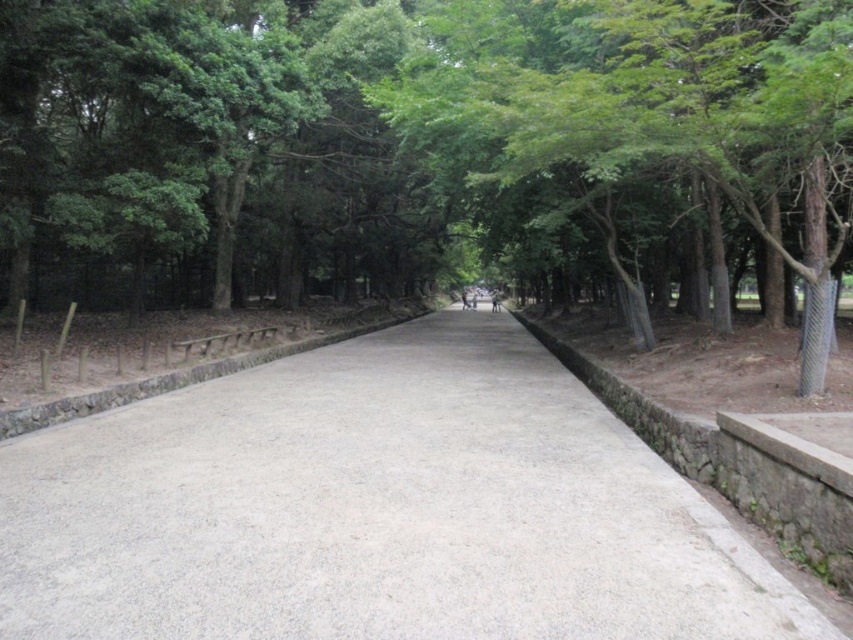
Which is in front, point (39, 19) or point (619, 440)?

Point (619, 440)

Does green leafy tree at center have a lesser width compared to gray concrete pavement at center?

In fact, green leafy tree at center might be wider than gray concrete pavement at center.

Image resolution: width=853 pixels, height=640 pixels. I want to click on green leafy tree at center, so click(x=412, y=141).

Identify the location of green leafy tree at center. (412, 141).